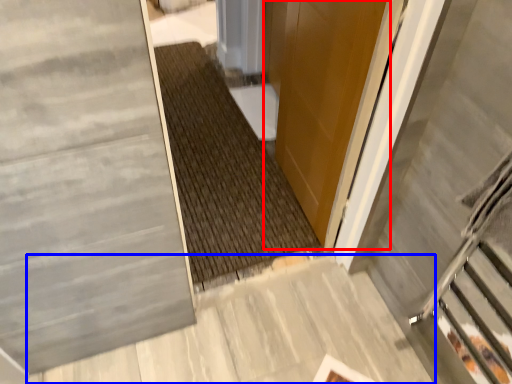
Question: Among these objects, which one is farthest to the camera, door (highlighted by a red box) or concrete (highlighted by a blue box)?

Choices:
 (A) door
 (B) concrete

Answer: (B)